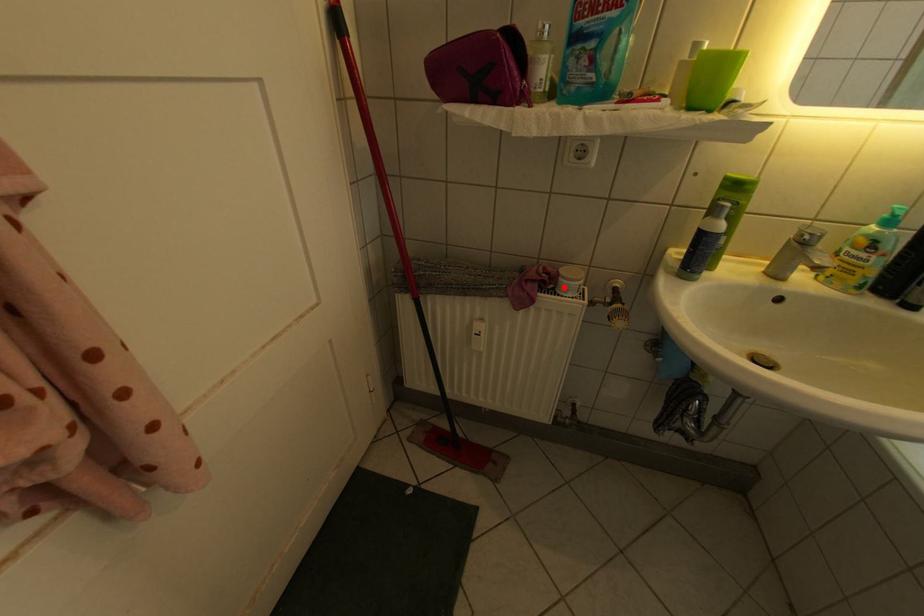
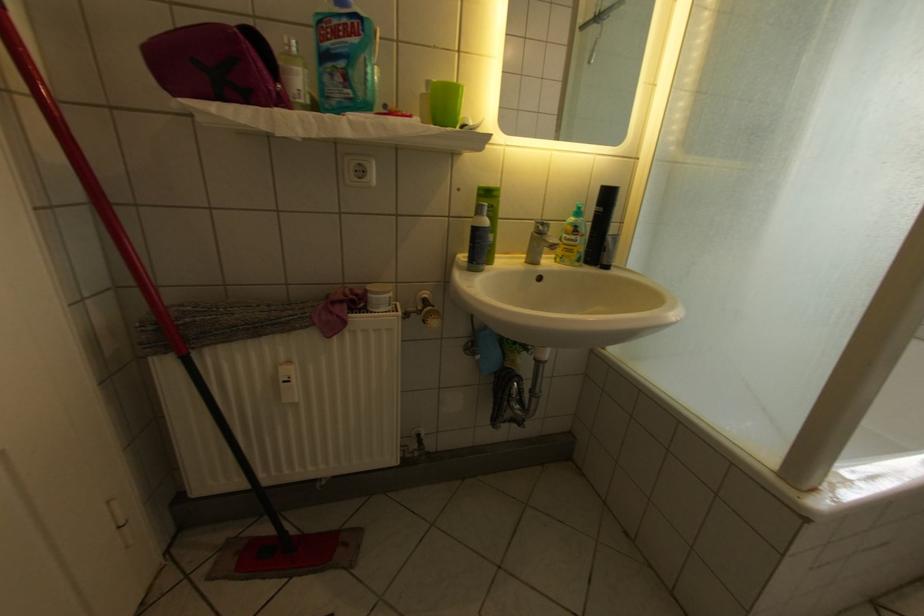
The point at the highlighted location is marked in the first image. Where is the corresponding point in the second image?

(374, 306)